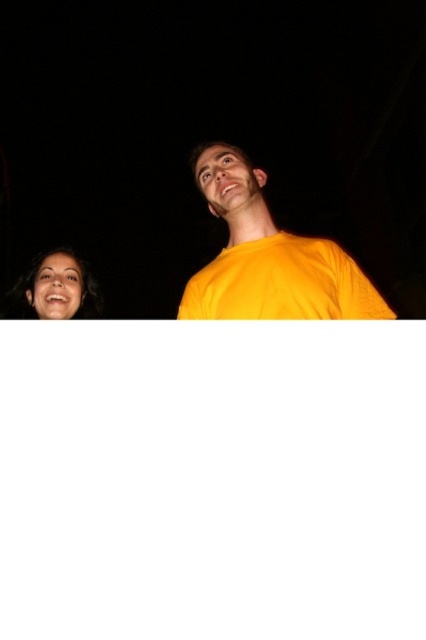
Question: Is yellow matte shirt at center below matte black face at lower left?

Choices:
 (A) yes
 (B) no

Answer: (B)

Question: Which point is farther to the camera?

Choices:
 (A) yellow matte shirt at center
 (B) matte black face at lower left

Answer: (B)

Question: Which point is farther to the camera?

Choices:
 (A) (229, 218)
 (B) (69, 304)

Answer: (B)

Question: Is yellow matte shirt at center smaller than matte black face at lower left?

Choices:
 (A) yes
 (B) no

Answer: (B)

Question: Which point is closer to the camera?

Choices:
 (A) (316, 292)
 (B) (49, 316)

Answer: (A)

Question: Can you confirm if yellow matte shirt at center is thinner than matte black face at lower left?

Choices:
 (A) no
 (B) yes

Answer: (A)